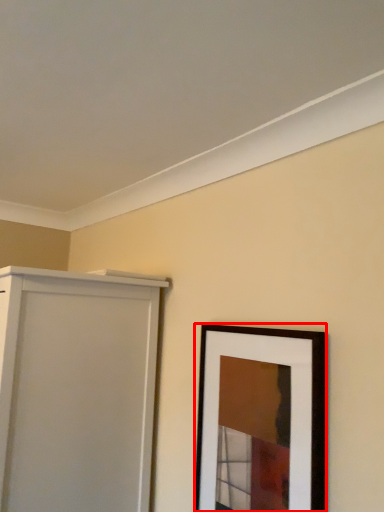
Question: From the image's perspective, where is picture frame (annotated by the red box) located in relation to door in the image?

Choices:
 (A) above
 (B) below

Answer: (A)